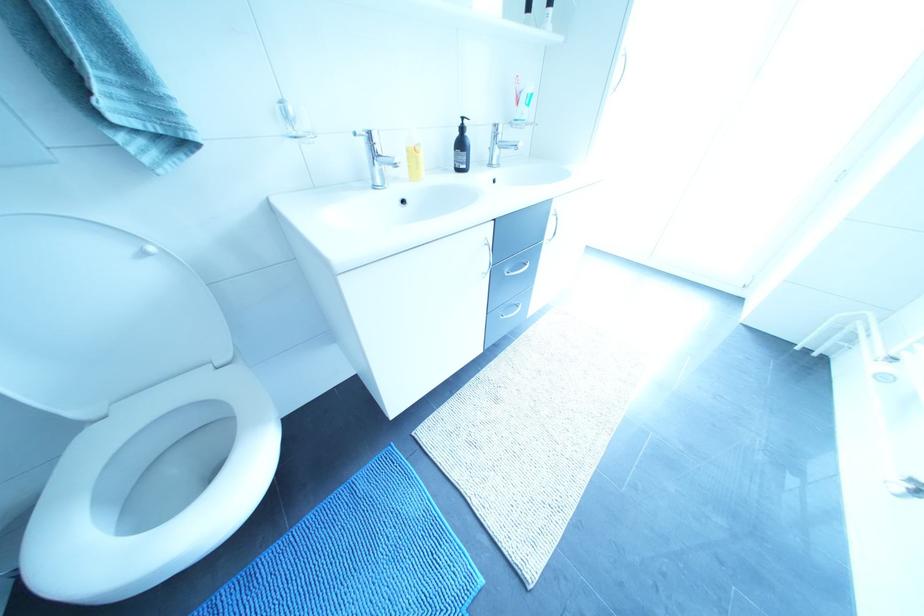
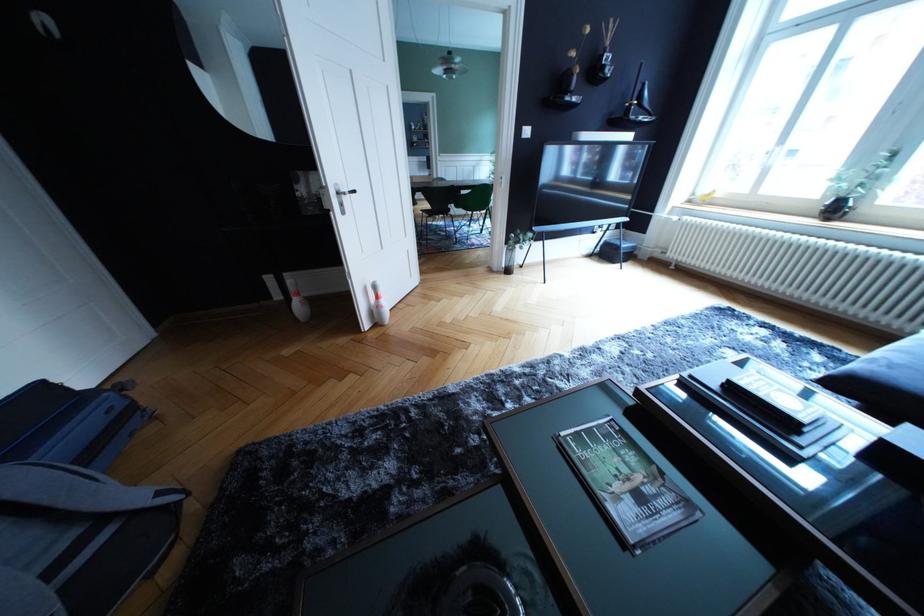
Question: I am providing you with two images of the same scene from different viewpoints. Please identify which objects are invisible in image2.

Choices:
 (A) white light switch
 (B) sofa sitting surface
 (C) black dispenser pump
 (D) translucent storage bin

Answer: (C)